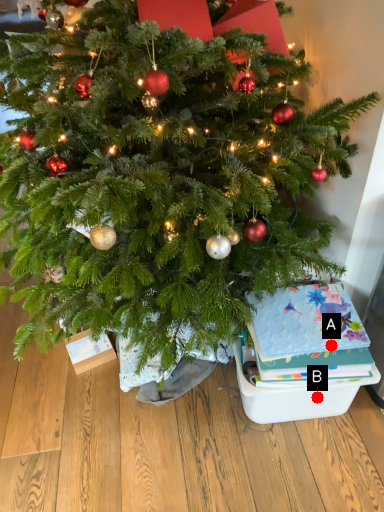
Question: Two points are circled on the image, labeled by A and B beside each circle. Which point is further to the camera?

Choices:
 (A) A is further
 (B) B is further

Answer: (B)